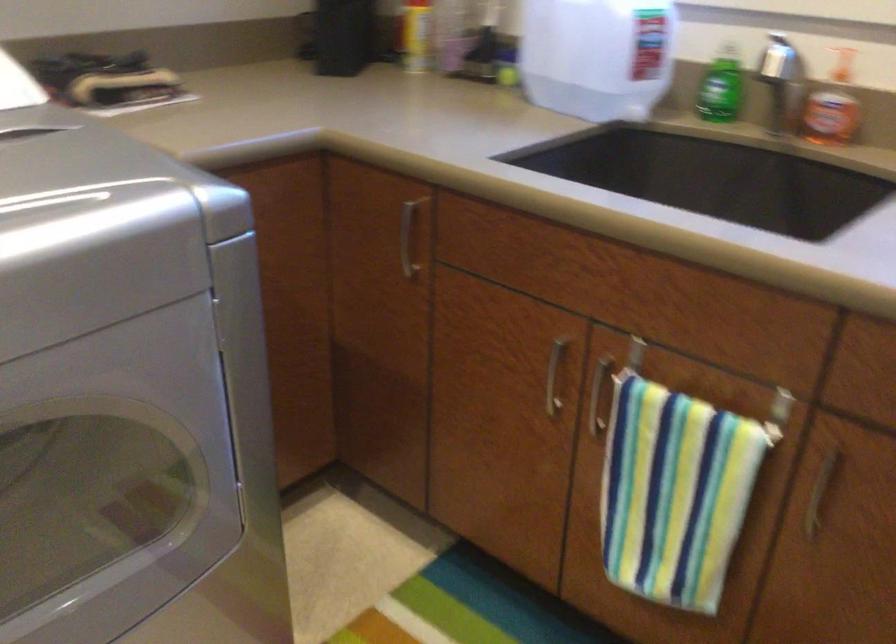
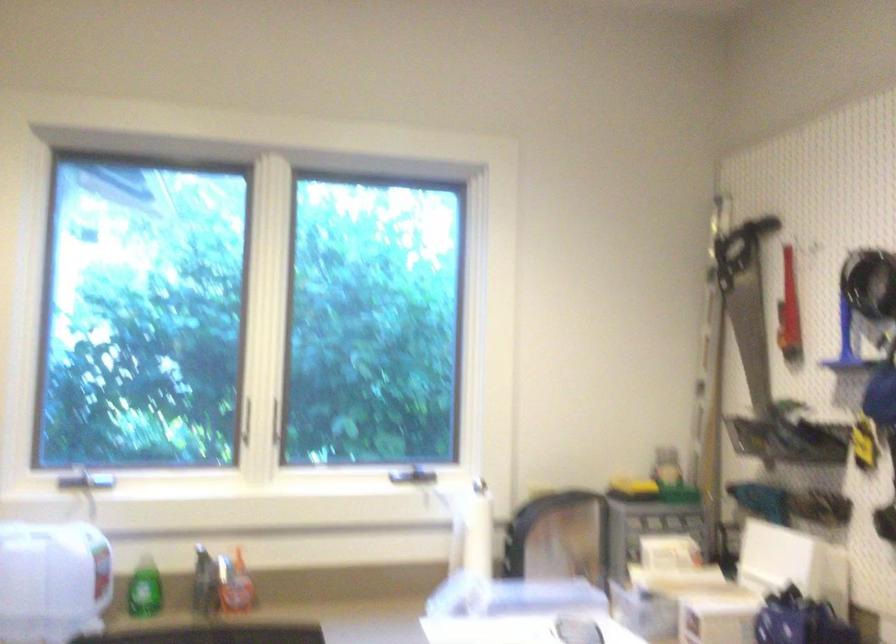
In the second image, find the point that corresponds to point 780,91 in the first image.

(204, 583)